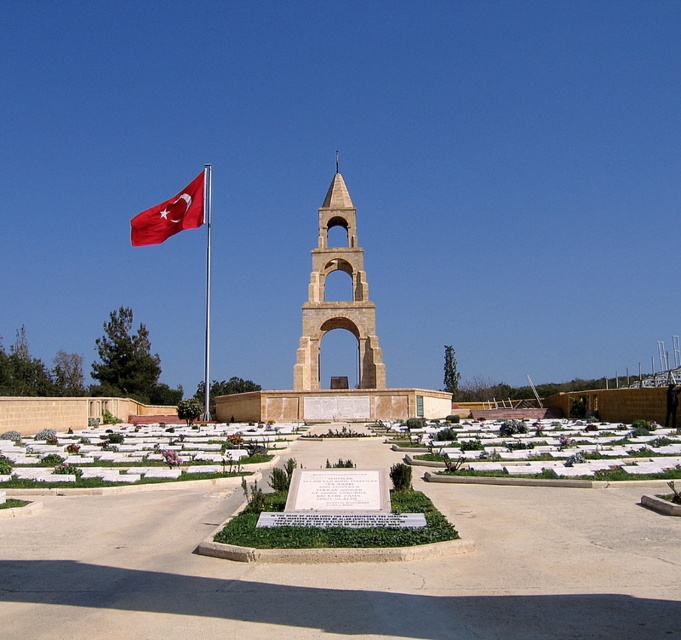
Question: Among these points, which one is farthest from the camera?

Choices:
 (A) (205, 353)
 (B) (140, 220)
 (C) (347, 328)

Answer: (A)

Question: Can you confirm if red fabric flag at left is wider than metallic flag pole at left?

Choices:
 (A) yes
 (B) no

Answer: (A)

Question: Which of the following is the farthest from the observer?

Choices:
 (A) red fabric flag at left
 (B) beige stone bell tower at center
 (C) metallic flag pole at left

Answer: (B)

Question: Considering the relative positions of beige stone bell tower at center and red fabric flag at left in the image provided, where is beige stone bell tower at center located with respect to red fabric flag at left?

Choices:
 (A) above
 (B) below

Answer: (B)

Question: Among these points, which one is nearest to the camera?

Choices:
 (A) (377, 339)
 (B) (206, 352)

Answer: (A)

Question: Does beige stone bell tower at center appear under red fabric flag at left?

Choices:
 (A) yes
 (B) no

Answer: (A)